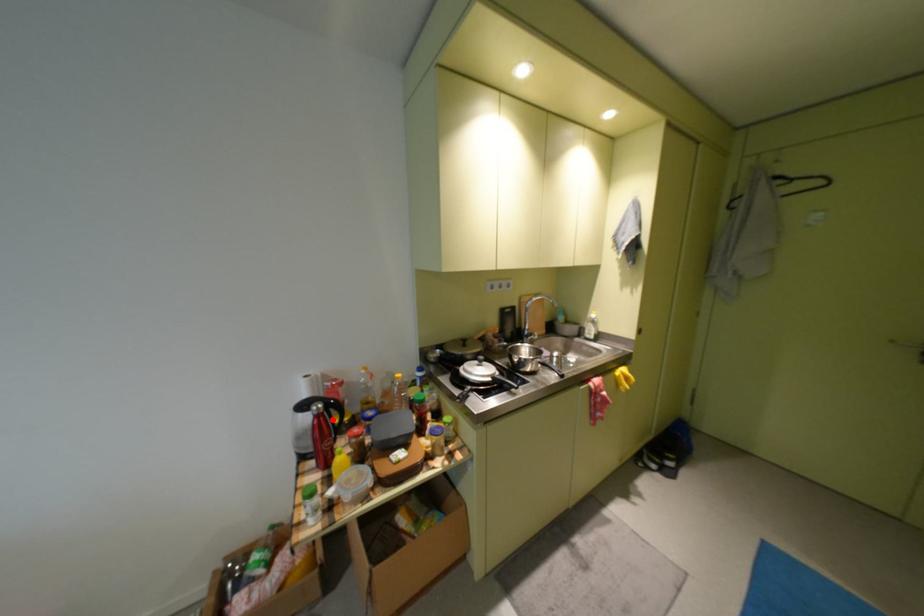
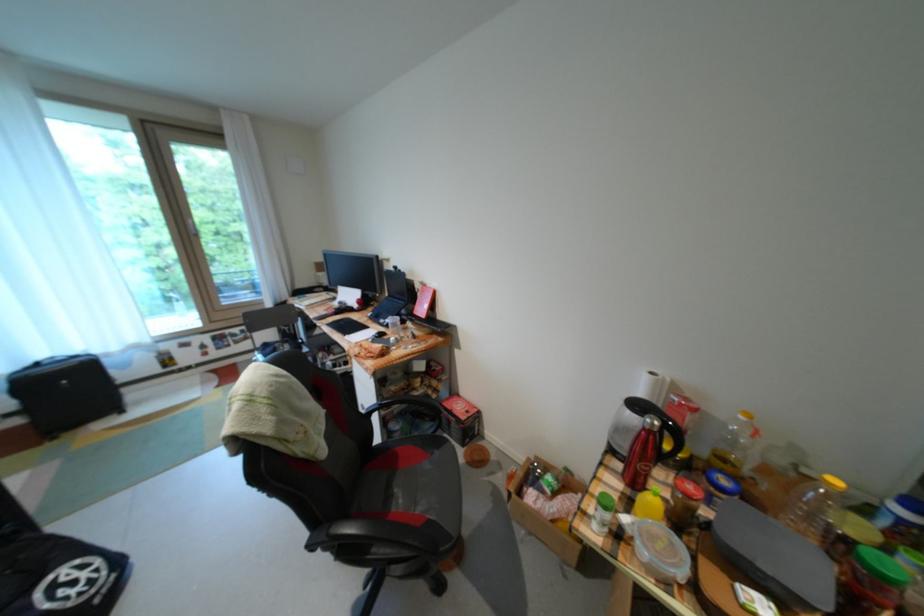
The point at the highlighted location is marked in the first image. Where is the corresponding point in the second image?

(662, 438)